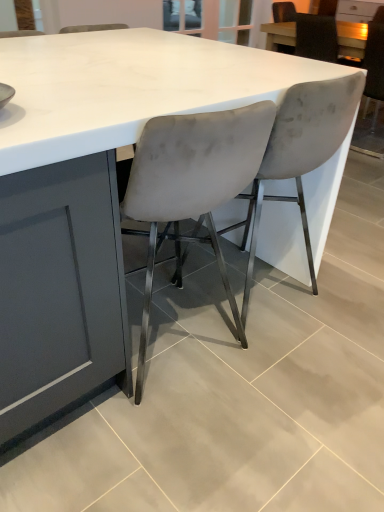
Question: Can you confirm if matte white table at upper right is thinner than velvet grey chair at center, the second chair viewed from the back?

Choices:
 (A) no
 (B) yes

Answer: (A)

Question: Is matte white table at upper right outside velvet grey chair at center, the second chair viewed from the back?

Choices:
 (A) no
 (B) yes

Answer: (B)

Question: Is matte white table at upper right smaller than velvet grey chair at center, which appears as the second chair when viewed from the front?

Choices:
 (A) yes
 (B) no

Answer: (A)

Question: From a real-world perspective, is matte white table at upper right physically below velvet grey chair at center, which appears as the second chair when viewed from the front?

Choices:
 (A) no
 (B) yes

Answer: (A)

Question: Can you confirm if matte white table at upper right is taller than velvet grey chair at center, which appears as the second chair when viewed from the front?

Choices:
 (A) no
 (B) yes

Answer: (A)

Question: From the image's perspective, is matte white table at upper right on top of velvet grey chair at center, which ranks as the 2th chair in left-to-right order?

Choices:
 (A) yes
 (B) no

Answer: (A)

Question: Is velvet gray chair at upper right, which is the third chair in left-to-right order, positioned beyond the bounds of matte white table at upper right?

Choices:
 (A) yes
 (B) no

Answer: (A)

Question: From the image's perspective, is velvet gray chair at upper right, placed as the first chair when sorted from right to left, below matte white table at upper right?

Choices:
 (A) no
 (B) yes

Answer: (B)

Question: From the image's perspective, is velvet gray chair at upper right, the first chair in the back-to-front sequence, on matte white table at upper right?

Choices:
 (A) no
 (B) yes

Answer: (A)

Question: Considering the relative positions of velvet gray chair at upper right, placed as the first chair when sorted from right to left, and matte white table at upper right in the image provided, is velvet gray chair at upper right, placed as the first chair when sorted from right to left, in front of matte white table at upper right?

Choices:
 (A) yes
 (B) no

Answer: (A)

Question: From a real-world perspective, does velvet gray chair at upper right, the first chair in the back-to-front sequence, stand above matte white table at upper right?

Choices:
 (A) yes
 (B) no

Answer: (B)

Question: Is velvet gray chair at upper right, the first chair in the back-to-front sequence, turned away from matte white table at upper right?

Choices:
 (A) no
 (B) yes

Answer: (A)

Question: Considering the relative positions of velvet grey chair at center, the second chair viewed from the back, and matte white table at upper right in the image provided, is velvet grey chair at center, the second chair viewed from the back, behind matte white table at upper right?

Choices:
 (A) yes
 (B) no

Answer: (B)